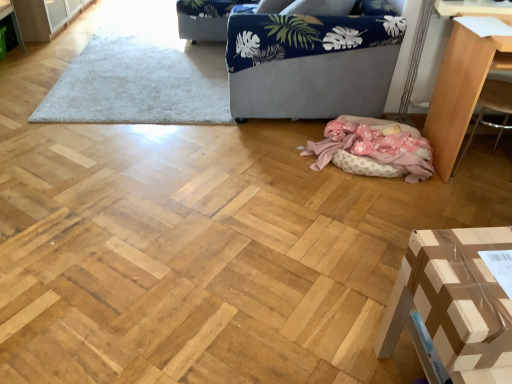
Question: From the image's perspective, is blue fabric armchair at upper center, the first armchair viewed from the top, located above or below light brown wood table at right, the second furniture viewed from the left?

Choices:
 (A) below
 (B) above

Answer: (B)

Question: Is blue fabric armchair at upper center, the first armchair viewed from the top, wider or thinner than light brown wood table at right, which appears as the first furniture when viewed from the right?

Choices:
 (A) wide
 (B) thin

Answer: (A)

Question: Which object is the closest to the wooden armchair at right, acting as the 2th armchair starting from the top?

Choices:
 (A) brown cardboard box at lower right, which is counted as the first furniture, starting from the bottom
 (B) navy blue fabric couch at upper center
 (C) blue fabric armchair at upper center, positioned as the first armchair in back-to-front order
 (D) white shaggy rug at upper center
 (E) pink polka dot fabric at lower center

Answer: (E)

Question: Which object is the farthest from the navy blue fabric couch at upper center?

Choices:
 (A) pink polka dot fabric at lower center
 (B) brown cardboard box at lower right, the first furniture from the front
 (C) white shaggy rug at upper center
 (D) blue fabric armchair at upper center, which is the 2th armchair from front to back
 (E) wooden armchair at right, arranged as the first armchair when viewed from the front

Answer: (B)